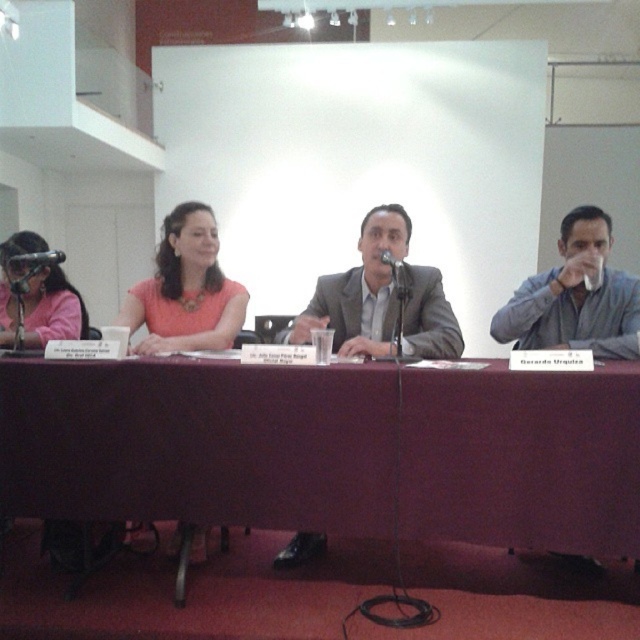
You are a server at a banquet hall and need to place a 40 inch long platter between the maroon fabric table at center and the matte gray shirt at right. Can you fit the platter between them without moving either object?

The distance between the maroon fabric table at center and the matte gray shirt at right is 37.58 inches, which is shorter than the platter length of 40 inches. The platter cannot fit between them without moving either object.